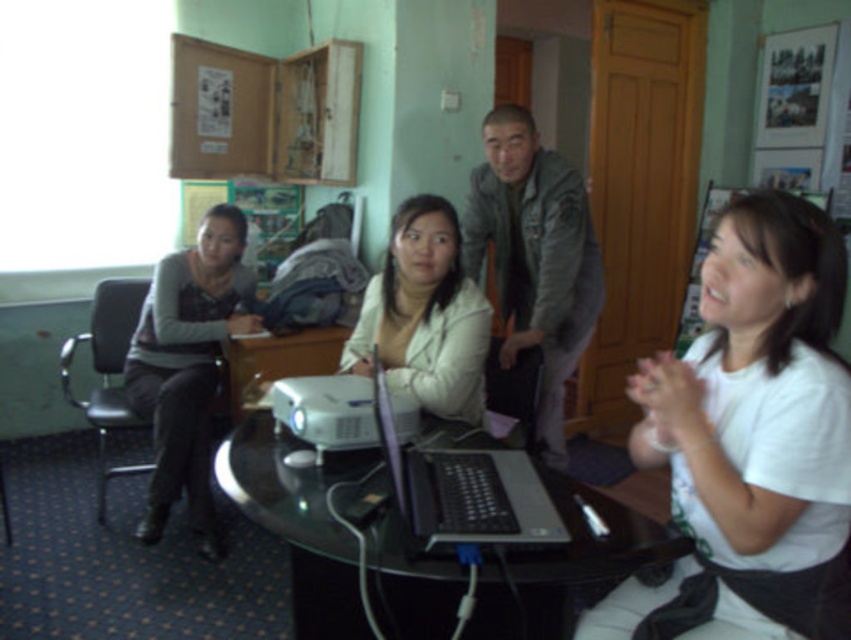
You are a person sitting at the black glass table at center. You want to place a 15 cm tall paperweight on the table. Can the white matte jacket at center block the view of the paperweight from someone standing behind you?

The black glass table at center is not as tall as the white matte jacket at center, so the jacket could potentially block the view of the paperweight from someone standing behind you.

In the scene shown: You are standing at the origin point of the coordinate system in the room. The room has a coordinate system where the bottom left corner is the origin. Where is the matte gray sweater at left located in this coordinate system?

The matte gray sweater at left is located at point [187,365] in the coordinate system.

From the picture: In the scene described, there are two white items of clothing visible. The first is a white matte shirt at lower right, and the second is a white matte jacket at center. From the perspective of someone standing at the table, which of these items is positioned to the right of the other?

The white matte shirt at lower right is positioned to the right of the white matte jacket at center.